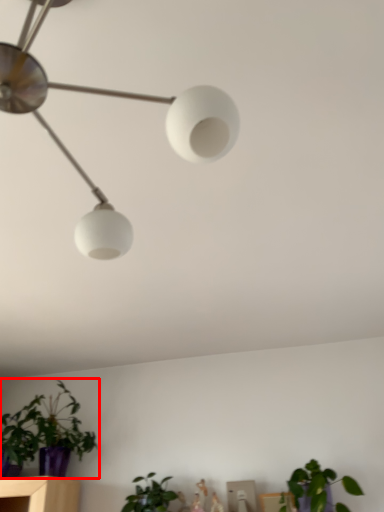
Question: From the image's perspective, where is houseplant (annotated by the red box) located relative to houseplant?

Choices:
 (A) below
 (B) above

Answer: (B)